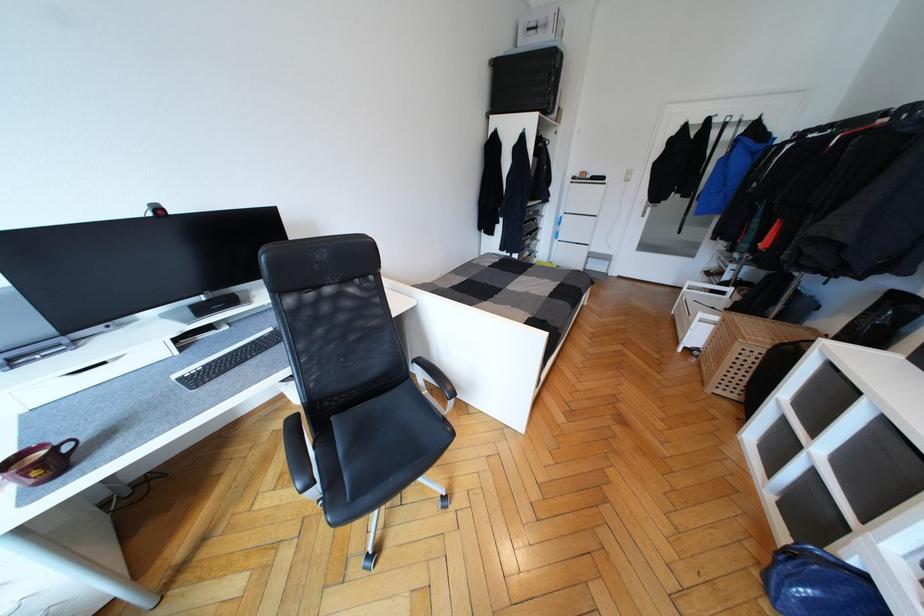
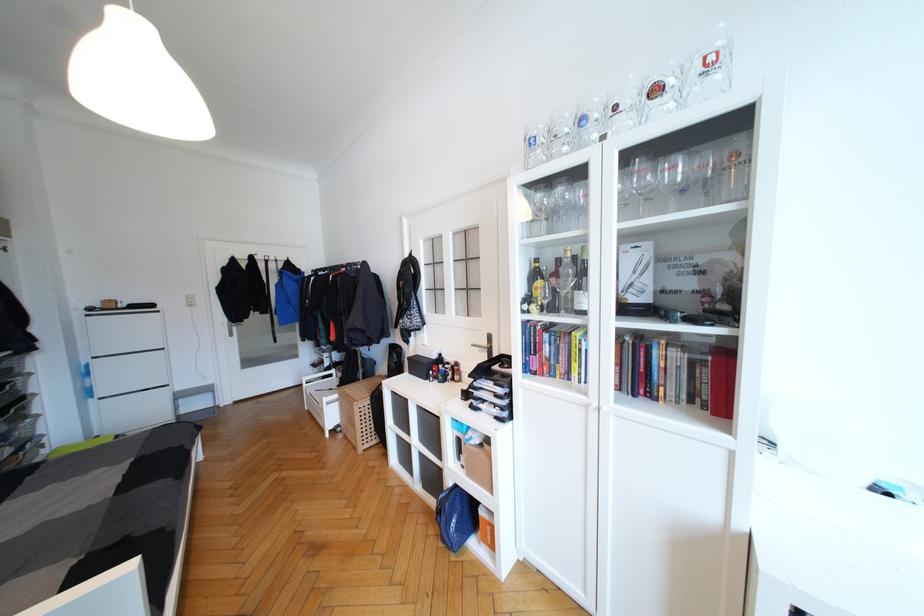
Where in the second image is the point corresponding to (563,238) from the first image?

(103, 395)